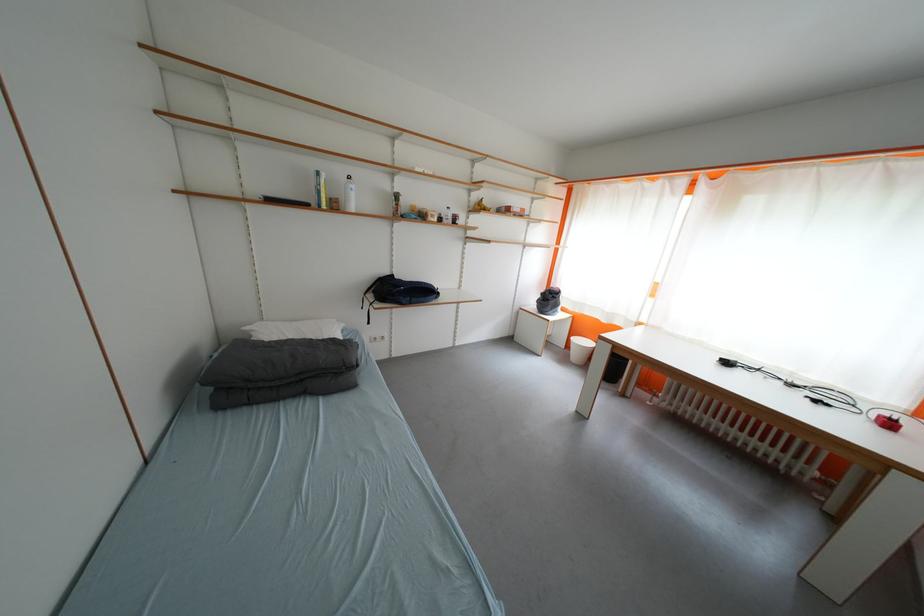
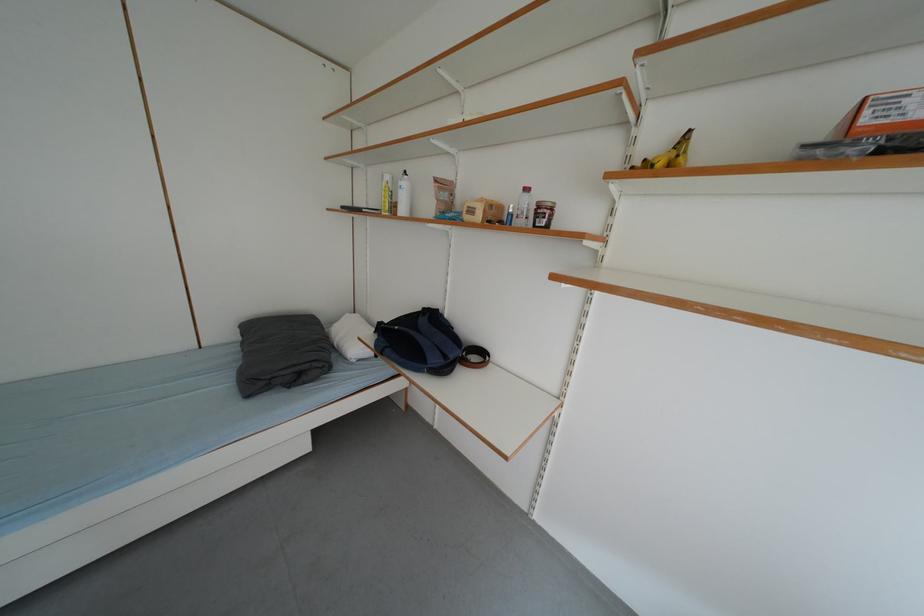
In the second image, find the point that corresponds to [444,223] in the first image.

(487, 220)